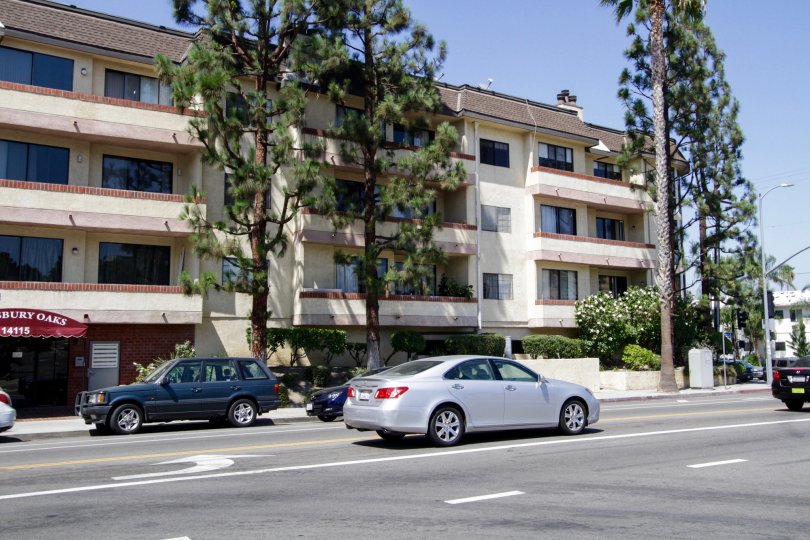
Image resolution: width=810 pixels, height=540 pixels. I want to click on windows above canopy, so click(x=30, y=259), click(x=43, y=183), click(x=23, y=78), click(x=118, y=92), click(x=130, y=183), click(x=133, y=264).